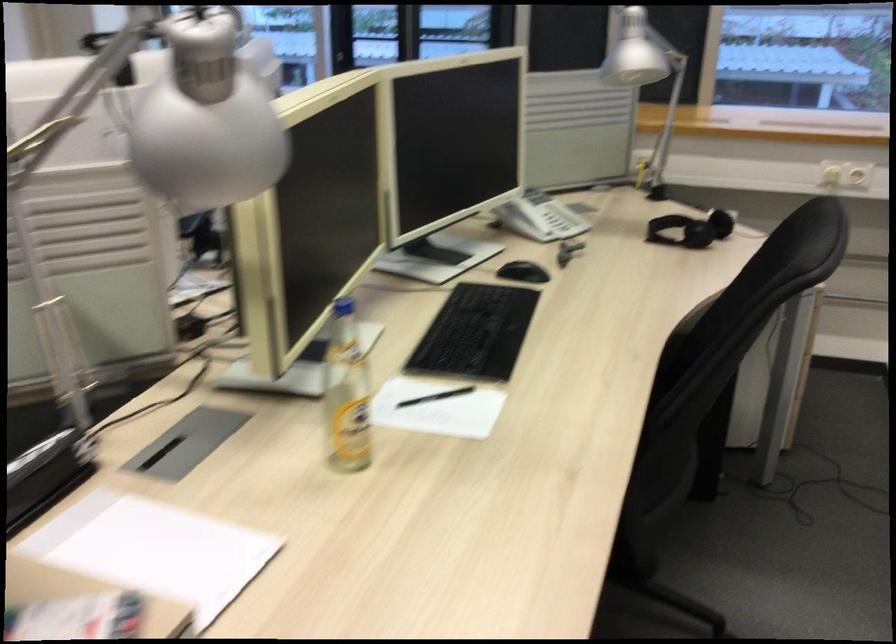
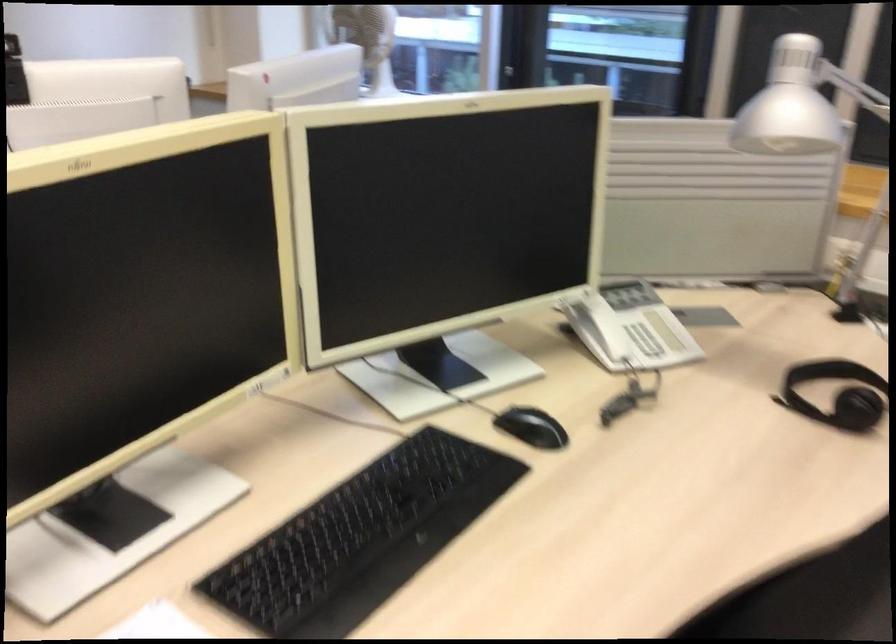
Question: The images are taken continuously from a first-person perspective. In which direction is your viewpoint rotating?

Choices:
 (A) Left
 (B) Right
 (C) Up
 (D) Down

Answer: (A)